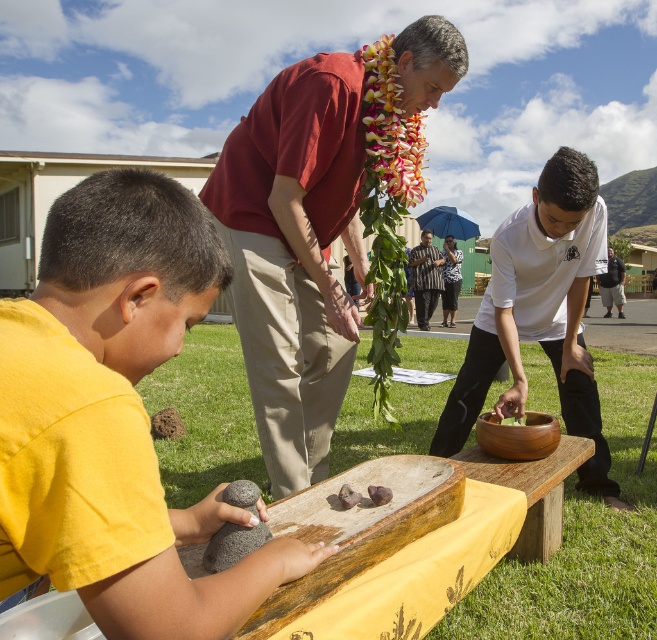
Question: Which object is closer to the camera taking this photo?

Choices:
 (A) wooden bowl at center
 (B) matte red shirt at center
 (C) smooth wood bowl at lower center

Answer: (B)

Question: Does dark gray fabric pants at center lie in front of brown rough rock at lower left?

Choices:
 (A) no
 (B) yes

Answer: (A)

Question: Which of the following is the farthest from the observer?

Choices:
 (A) (66, 493)
 (B) (417, 301)
 (C) (170, 435)
 (D) (250, 396)

Answer: (B)

Question: Where is dark gray fabric pants at center located in relation to brown rough rock at lower left in the image?

Choices:
 (A) left
 (B) right

Answer: (B)

Question: Which of the following is the closest to the observer?

Choices:
 (A) (430, 300)
 (B) (302, 364)
 (C) (524, 256)
 (D) (104, 582)

Answer: (D)

Question: Can you confirm if smooth wood bowl at lower center is smaller than brown rough rock at lower left?

Choices:
 (A) yes
 (B) no

Answer: (A)